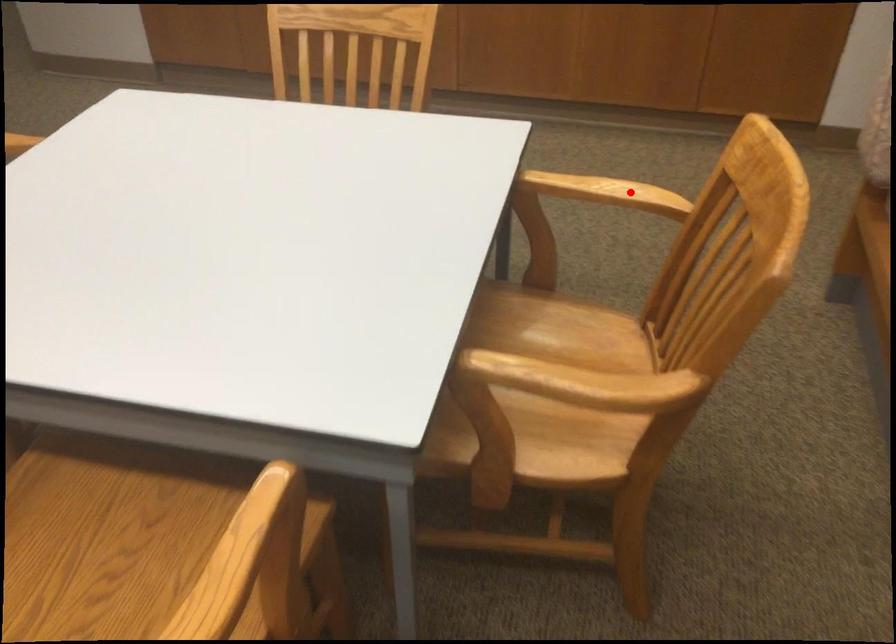
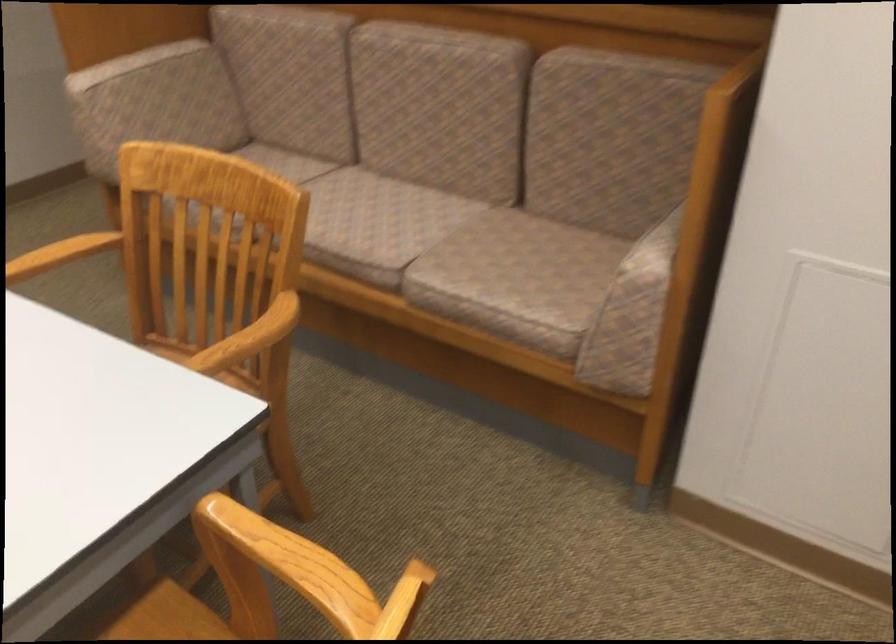
Question: I am providing you with two images of the same scene from different viewpoints. Image1 has a red point marked. In image2, the corresponding 3D location appears at what relative position? Reply with the corresponding letter.

Choices:
 (A) Closer
 (B) Farther

Answer: (B)